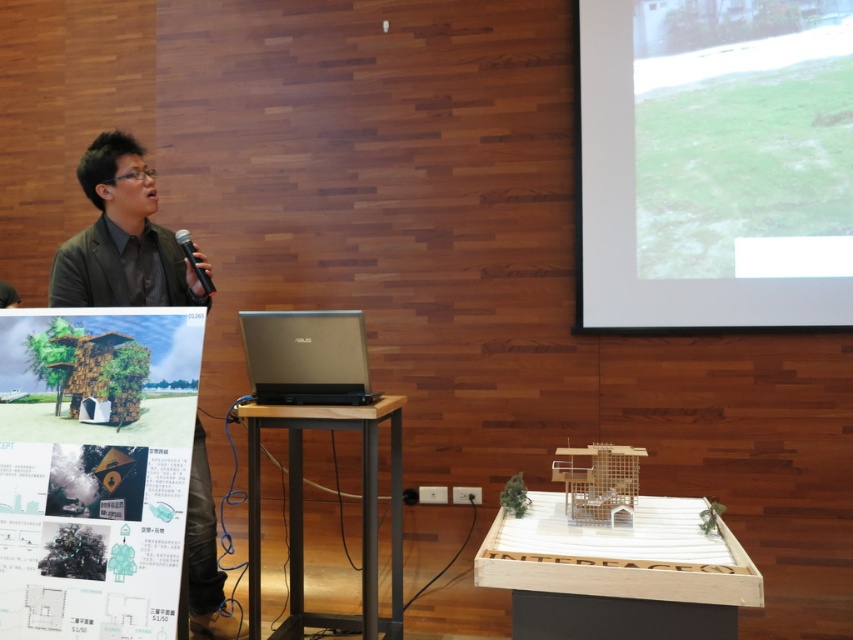
Question: Does wooden house at lower left have a greater width compared to black plastic microphone at center?

Choices:
 (A) yes
 (B) no

Answer: (A)

Question: Which point appears farthest from the camera in this image?

Choices:
 (A) (178, 243)
 (B) (363, 472)

Answer: (A)

Question: Which object appears closest to the camera in this image?

Choices:
 (A) black plastic microphone at center
 (B) wooden model house at center
 (C) wooden podium at center

Answer: (B)

Question: Is wooden podium at center bigger than black plastic microphone at center?

Choices:
 (A) yes
 (B) no

Answer: (A)

Question: Which object is the closest to the satin gold laptop at center?

Choices:
 (A) wooden podium at center
 (B) wooden house at lower left
 (C) black plastic microphone at center
 (D) dark gray suit at left

Answer: (A)

Question: Is green grass at upper right to the left of wooden model house at center from the viewer's perspective?

Choices:
 (A) yes
 (B) no

Answer: (B)